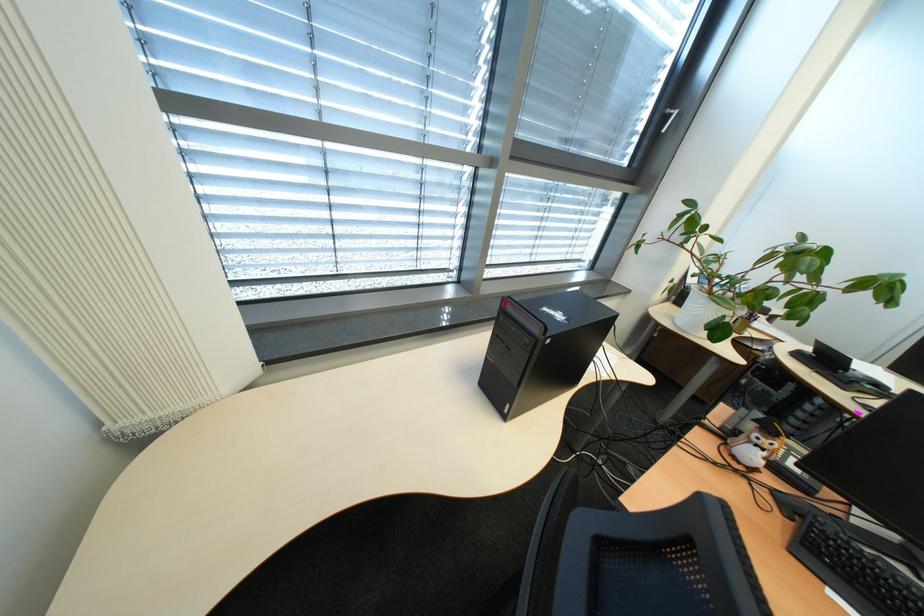
Where is `beaded blind chain`? The height and width of the screenshot is (616, 924). beaded blind chain is located at coordinates (153, 421).